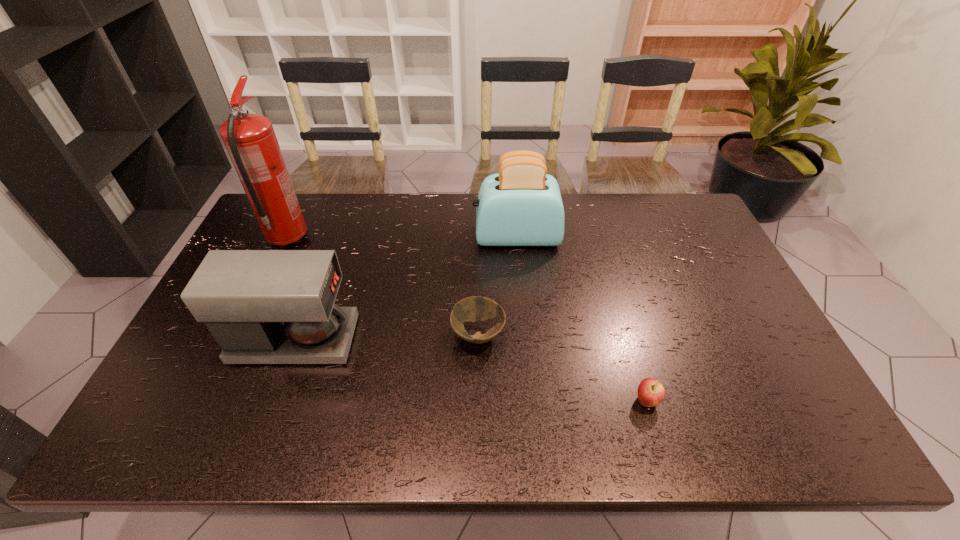
This screenshot has width=960, height=540. What are the coordinates of `free space between the tallest object and the bowl` in the screenshot? It's located at (383, 287).

Where is `vacant space in between the toaster and the fire extinguisher`? vacant space in between the toaster and the fire extinguisher is located at coordinates click(x=402, y=238).

I want to click on free spot between the toaster and the bowl, so click(497, 286).

Locate which object is the fourth closest to the apple. Please provide its 2D coordinates. Your answer should be formatted as a tuple, i.e. [(x, y)], where the tuple contains the x and y coordinates of a point satisfying the conditions above.

[(250, 140)]

Point out which object is positioned as the nearest to the coffee maker. Please provide its 2D coordinates. Your answer should be formatted as a tuple, i.e. [(x, y)], where the tuple contains the x and y coordinates of a point satisfying the conditions above.

[(250, 140)]

At what (x,y) coordinates should I click in order to perform the action: click on free location that satisfies the following two spatial constraints: 1. on the front side of the bowl; 2. on the left side of the apple. Please return your answer as a coordinate pair (x, y). Looking at the image, I should click on (478, 401).

Locate an element on the screen. vacant space that satisfies the following two spatial constraints: 1. on the front side of the bowl; 2. on the right side of the rightmost object is located at coordinates (478, 401).